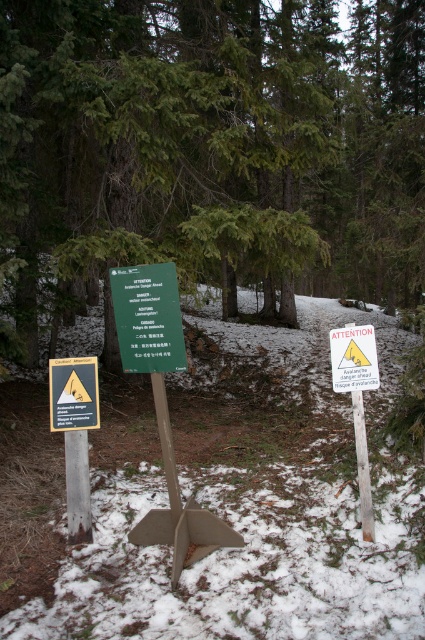
Question: Estimate the real-world distances between objects in this image. Which object is closer to the yellowmaterial/texturesign at left?

Choices:
 (A) white paper sign at center
 (B) green wood sign at center

Answer: (B)

Question: Can you confirm if green wood sign at center is positioned to the right of yellowmaterial/texturesign at left?

Choices:
 (A) yes
 (B) no

Answer: (A)

Question: Where is green matte sign at center located in relation to green wood sign at center in the image?

Choices:
 (A) left
 (B) right

Answer: (B)

Question: Which point is closer to the camera?

Choices:
 (A) green wood sign at center
 (B) yellowmaterial/texturesign at left
 (C) green matte sign at center
 (D) white paper sign at center

Answer: (A)

Question: Is green wood sign at center to the right of white paper sign at center from the viewer's perspective?

Choices:
 (A) yes
 (B) no

Answer: (B)

Question: Which is nearer to the green wood sign at center?

Choices:
 (A) yellowmaterial/texturesign at left
 (B) green matte sign at center
 (C) white paper sign at center

Answer: (A)